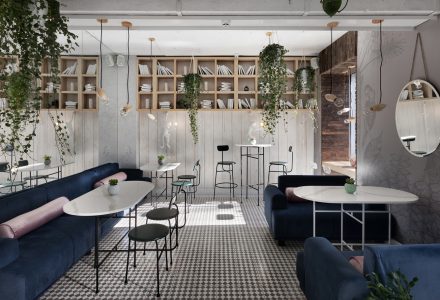
Where is `tables`? tables is located at coordinates (128, 193), (166, 165), (246, 143), (326, 196), (33, 163).